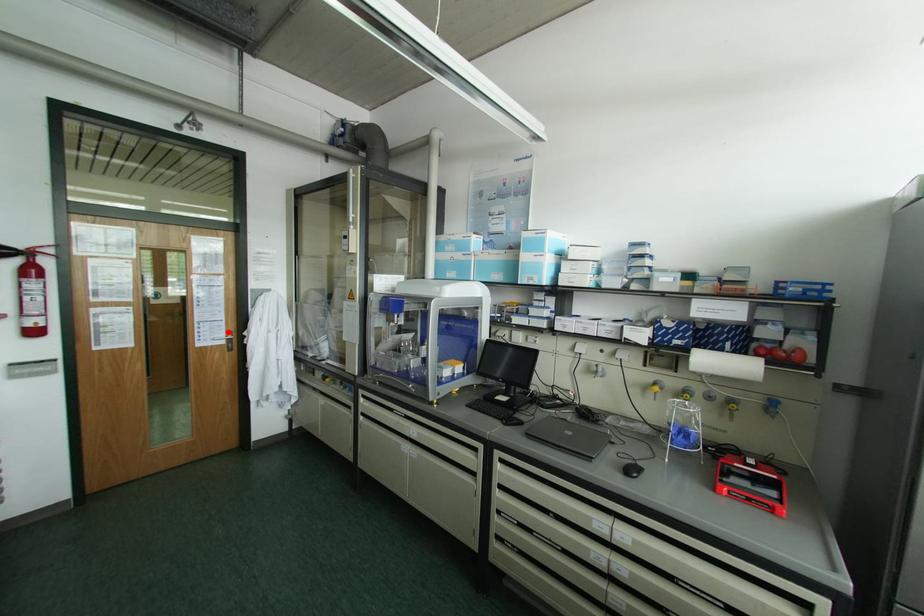
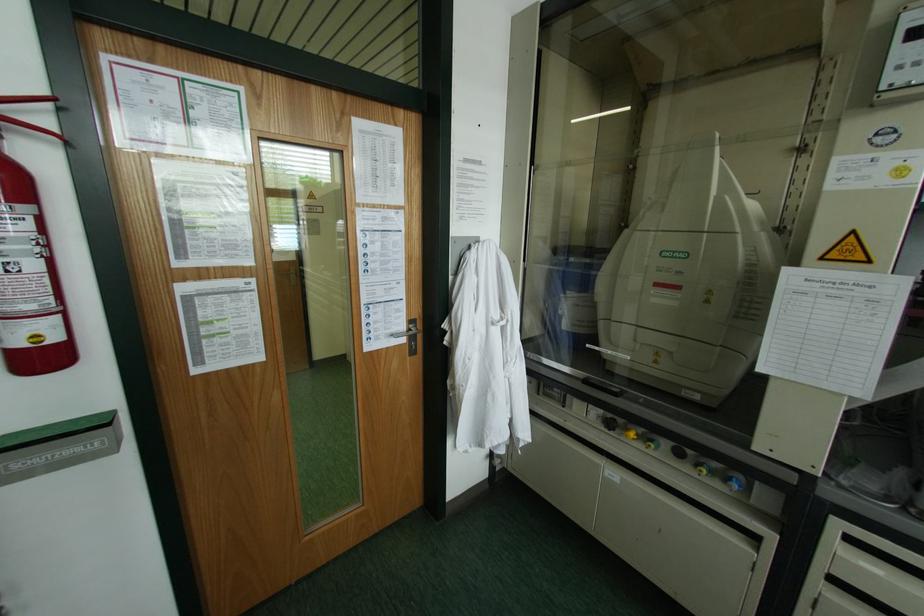
Find the pixel in the second image that matches the highlighted location in the first image.

(409, 321)